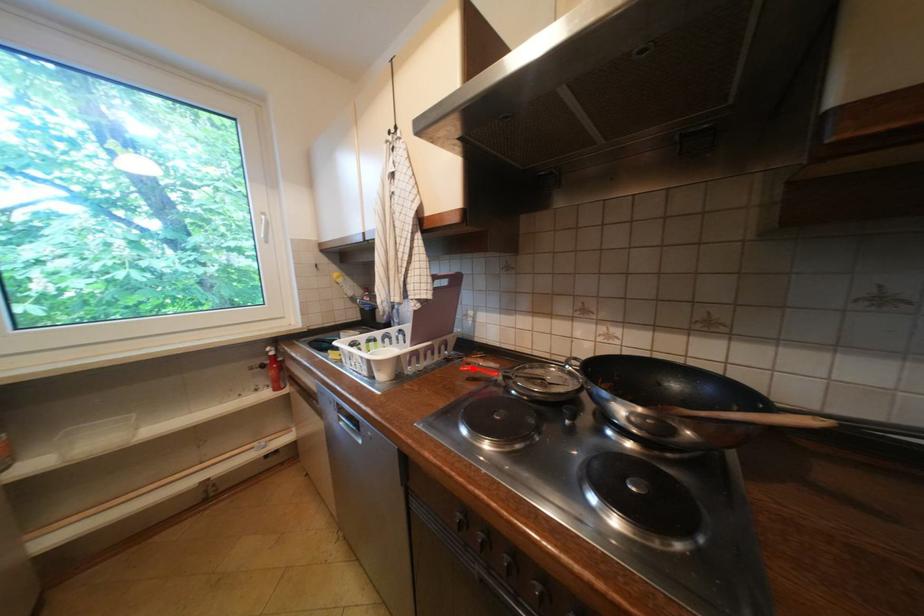
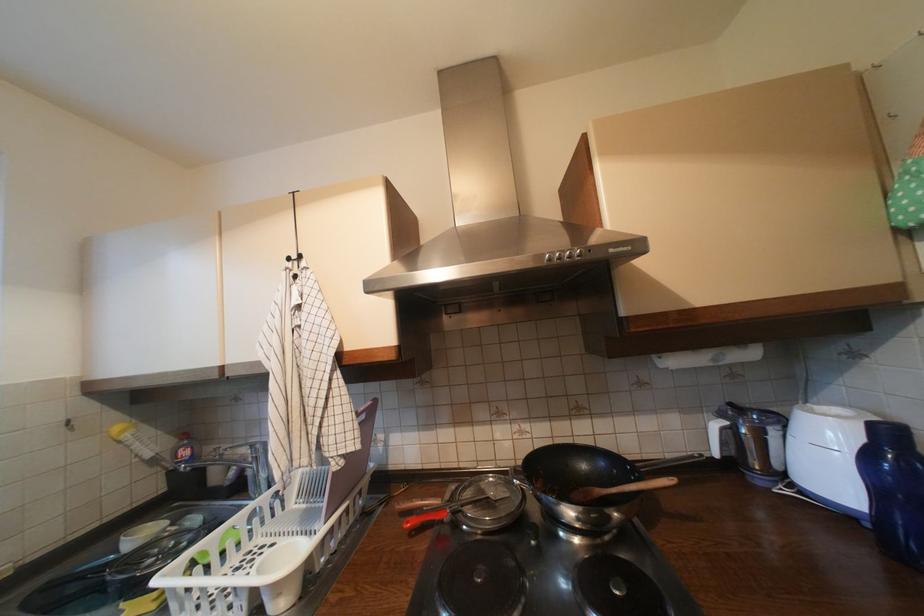
Question: I am providing you with two images of the same scene from different viewpoints. A red point is marked on the first image. Is the red point's position out of view in image 2?

Choices:
 (A) Yes
 (B) No

Answer: (B)